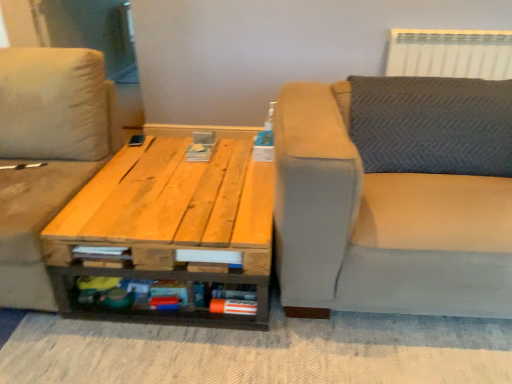
Question: Does beige fabric studio couch at left, the 1th studio couch when ordered from left to right, turn towards light gray fabric couch at right, arranged as the second studio couch when viewed from the left?

Choices:
 (A) no
 (B) yes

Answer: (A)

Question: Does beige fabric studio couch at left, the 1th studio couch when ordered from left to right, appear on the right side of light gray fabric couch at right, arranged as the second studio couch when viewed from the left?

Choices:
 (A) no
 (B) yes

Answer: (A)

Question: Does beige fabric studio couch at left, the 1th studio couch when ordered from left to right, have a greater width compared to light gray fabric couch at right, the first studio couch viewed from the right?

Choices:
 (A) yes
 (B) no

Answer: (B)

Question: Are beige fabric studio couch at left, placed as the 2th studio couch when sorted from right to left, and light gray fabric couch at right, arranged as the second studio couch when viewed from the left, far apart?

Choices:
 (A) yes
 (B) no

Answer: (A)

Question: Does beige fabric studio couch at left, placed as the 2th studio couch when sorted from right to left, have a larger size compared to light gray fabric couch at right, the first studio couch viewed from the right?

Choices:
 (A) no
 (B) yes

Answer: (A)

Question: In terms of size, does white plastic radiator at upper right appear bigger or smaller than light gray fabric couch at right, arranged as the second studio couch when viewed from the left?

Choices:
 (A) small
 (B) big

Answer: (A)

Question: Would you say white plastic radiator at upper right is to the left or to the right of light gray fabric couch at right, arranged as the second studio couch when viewed from the left, in the picture?

Choices:
 (A) right
 (B) left

Answer: (A)

Question: From the image's perspective, is white plastic radiator at upper right located above or below light gray fabric couch at right, arranged as the second studio couch when viewed from the left?

Choices:
 (A) below
 (B) above

Answer: (B)

Question: Considering their positions, is white plastic radiator at upper right located in front of or behind light gray fabric couch at right, arranged as the second studio couch when viewed from the left?

Choices:
 (A) front
 (B) behind

Answer: (B)

Question: Looking at their shapes, would you say natural wood table at center is wider or thinner than white plastic radiator at upper right?

Choices:
 (A) wide
 (B) thin

Answer: (A)

Question: In the image, is natural wood table at center positioned in front of or behind white plastic radiator at upper right?

Choices:
 (A) front
 (B) behind

Answer: (A)

Question: From a real-world perspective, is natural wood table at center physically located above or below white plastic radiator at upper right?

Choices:
 (A) below
 (B) above

Answer: (A)

Question: Is natural wood table at center to the left or to the right of white plastic radiator at upper right in the image?

Choices:
 (A) left
 (B) right

Answer: (A)

Question: Visually, is light gray fabric couch at right, arranged as the second studio couch when viewed from the left, positioned to the left or to the right of natural wood table at center?

Choices:
 (A) left
 (B) right

Answer: (B)

Question: Looking at their shapes, would you say light gray fabric couch at right, the first studio couch viewed from the right, is wider or thinner than natural wood table at center?

Choices:
 (A) wide
 (B) thin

Answer: (A)